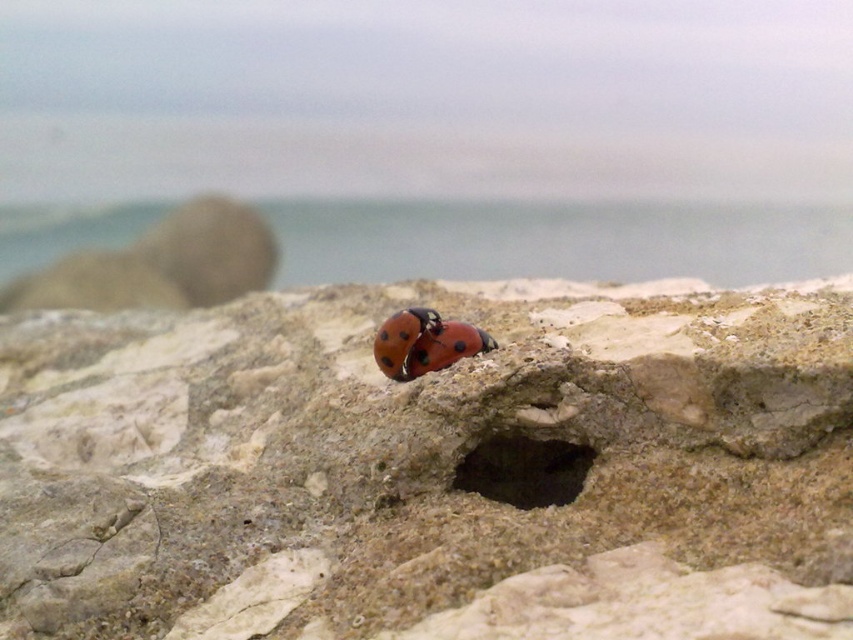
Does smooth stone ladybug at center appear on the right side of dark stone hole at center?

In fact, smooth stone ladybug at center is to the left of dark stone hole at center.

Does smooth stone ladybug at center have a smaller size compared to dark stone hole at center?

No.

Does point (689, 598) come farther from viewer compared to point (500, 432)?

That is False.

Find the location of a particular element. smooth stone ladybug at center is located at coordinates (430, 468).

Which is below, smooth stone ladybug at center or shiny red beetle at center?

smooth stone ladybug at center is below.

The image size is (853, 640). Identify the location of smooth stone ladybug at center. (430, 468).

This screenshot has height=640, width=853. Identify the location of dark stone hole at center. (524, 468).

Who is higher up, dark stone hole at center or shiny red beetle at center?

shiny red beetle at center is above.

The height and width of the screenshot is (640, 853). I want to click on dark stone hole at center, so click(524, 468).